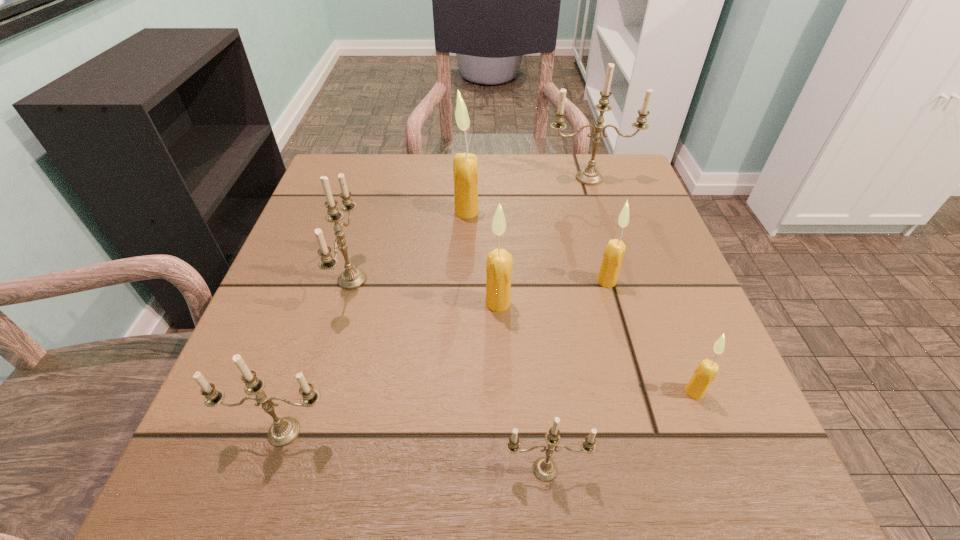
Identify the location of vacant area that satisfies the following two spatial constraints: 1. on the back side of the rightmost cream candle; 2. on the right side of the third metallic candle from left to right. The width and height of the screenshot is (960, 540). (538, 392).